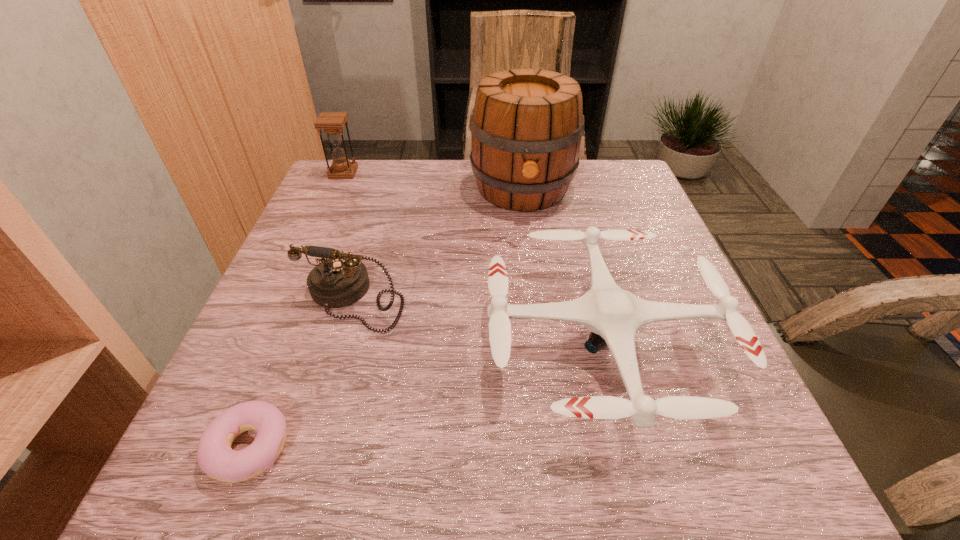
In the image, there is a desktop. Where is `vacant space at the far edge`? vacant space at the far edge is located at coordinates (575, 201).

The height and width of the screenshot is (540, 960). I want to click on vacant space at the near edge of the desktop, so click(364, 451).

In order to click on free region at the left edge in this screenshot , I will do `click(257, 340)`.

The image size is (960, 540). In the image, there is a desktop. In order to click on free region at the right edge in this screenshot , I will do `click(735, 378)`.

Locate an element on the screen. free location at the far left corner is located at coordinates (357, 189).

Identify the location of vacant space at the far right corner of the desktop. (628, 190).

Image resolution: width=960 pixels, height=540 pixels. I want to click on free space between the second tallest object and the drone, so click(x=473, y=257).

Where is `free space between the telephone and the doughnut`? free space between the telephone and the doughnut is located at coordinates (301, 374).

Identify the location of empty space between the telephone and the cider. (438, 244).

Locate an element on the screen. vacant space in between the drone and the tallest object is located at coordinates (563, 265).